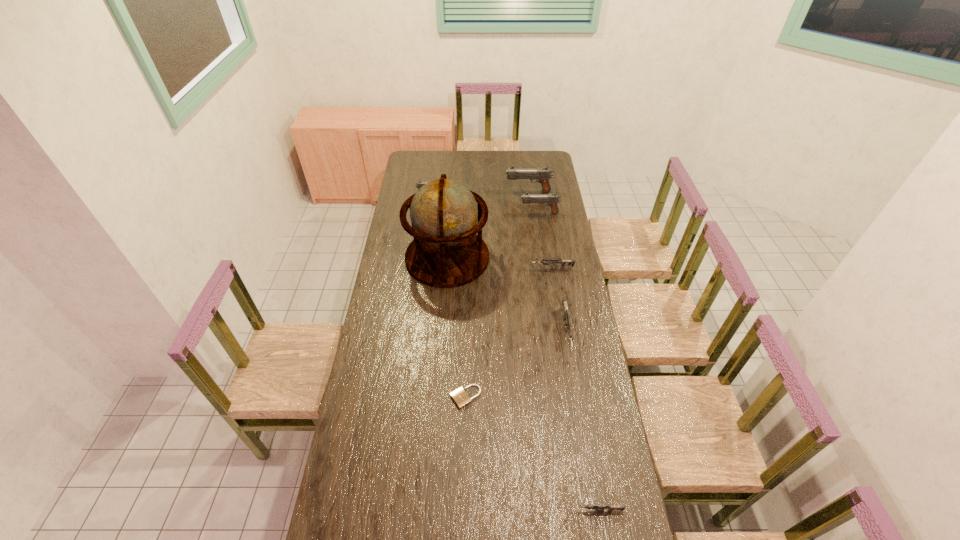
The height and width of the screenshot is (540, 960). In order to click on free space located in the direction the fourth nearest gun is aimed in this screenshot , I will do `click(453, 213)`.

At what (x,y) coordinates should I click in order to perform the action: click on free point located in the direction the fourth nearest gun is aimed. Please return your answer as a coordinate pair (x, y). The width and height of the screenshot is (960, 540). Looking at the image, I should click on (458, 213).

At what (x,y) coordinates should I click in order to perform the action: click on vacant area located in the direction the second nearest gray gun is aimed. Please return your answer as a coordinate pair (x, y). Image resolution: width=960 pixels, height=540 pixels. Looking at the image, I should click on (509, 196).

At what (x,y) coordinates should I click in order to perform the action: click on vacant space situated aimed along the barrel of the second nearest grey gun. Please return your answer as a coordinate pair (x, y). This screenshot has height=540, width=960. Looking at the image, I should click on (588, 451).

The image size is (960, 540). I want to click on vacant space located aimed along the barrel of the second biggest grey gun, so click(492, 268).

At what (x,y) coordinates should I click in order to perform the action: click on vacant space located 0.110m aimed along the barrel of the second biggest grey gun. Please return your answer as a coordinate pair (x, y). This screenshot has width=960, height=540. Looking at the image, I should click on (506, 268).

Locate an element on the screen. vacant region located aimed along the barrel of the second biggest grey gun is located at coordinates (515, 268).

Where is `free region located 0.370m aimed along the barrel of the nearest grey gun`? The height and width of the screenshot is (540, 960). free region located 0.370m aimed along the barrel of the nearest grey gun is located at coordinates (452, 510).

Locate an element on the screen. free region located 0.100m aimed along the barrel of the nearest grey gun is located at coordinates (539, 510).

This screenshot has height=540, width=960. I want to click on vacant point located aimed along the barrel of the nearest grey gun, so click(526, 510).